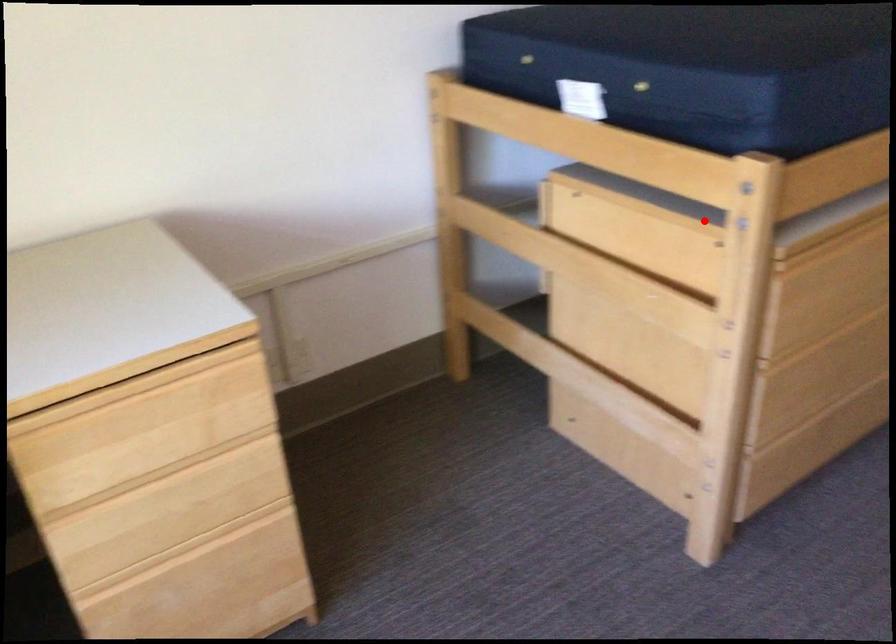
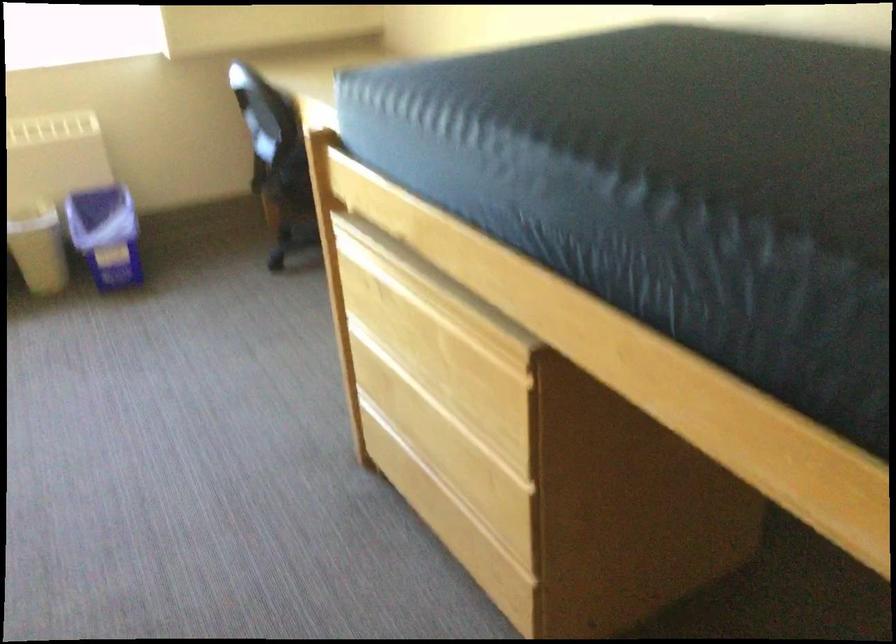
Question: I am providing you with two images of the same scene from different viewpoints. A red point is marked on the first image. At the location where the point appears in image 1, is it still visible in image 2?

Choices:
 (A) Yes
 (B) No

Answer: (B)